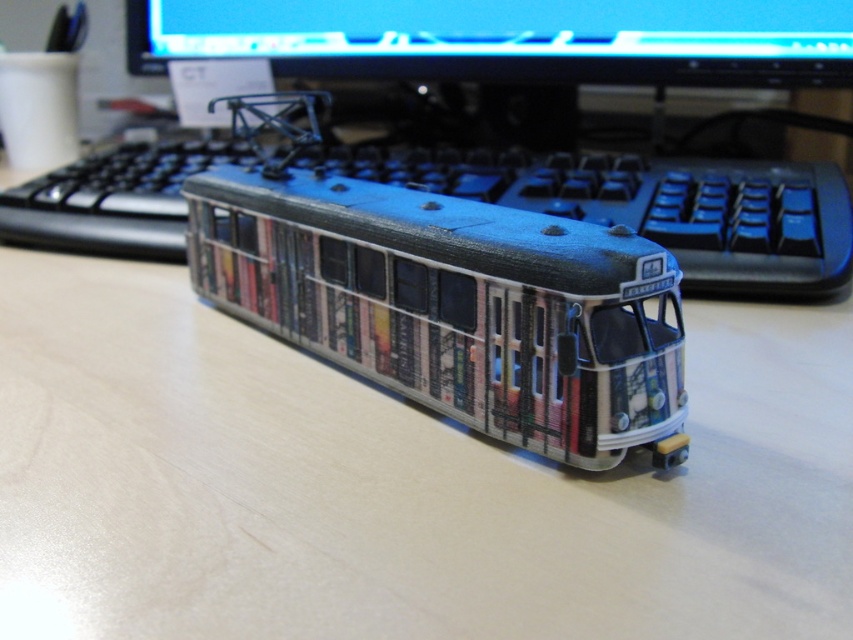
Question: Which object is the farthest from the matte black monitor at upper center?

Choices:
 (A) blue plastic keyboard at center
 (B) metallic silver tram at center

Answer: (B)

Question: Does metallic silver tram at center appear on the left side of blue plastic keyboard at center?

Choices:
 (A) yes
 (B) no

Answer: (A)

Question: Is metallic silver tram at center to the right of blue plastic keyboard at center from the viewer's perspective?

Choices:
 (A) no
 (B) yes

Answer: (A)

Question: Which of the following is the farthest from the observer?

Choices:
 (A) [x=155, y=172]
 (B) [x=292, y=196]

Answer: (A)

Question: Can you confirm if metallic silver tram at center is positioned to the right of matte black monitor at upper center?

Choices:
 (A) yes
 (B) no

Answer: (B)

Question: Which object is positioned farthest from the metallic silver tram at center?

Choices:
 (A) blue plastic keyboard at center
 (B) matte black monitor at upper center

Answer: (B)